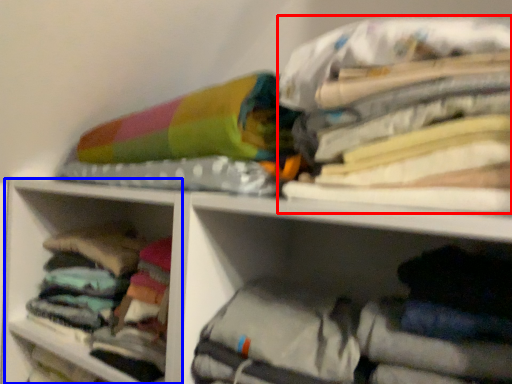
Question: Which object is further to the camera taking this photo, clothing (highlighted by a red box) or cabinet (highlighted by a blue box)?

Choices:
 (A) clothing
 (B) cabinet

Answer: (B)